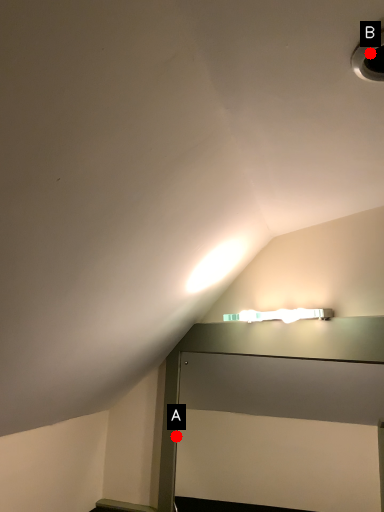
Question: Two points are circled on the image, labeled by A and B beside each circle. Which of the following is the farthest from the observer?

Choices:
 (A) A is further
 (B) B is further

Answer: (A)